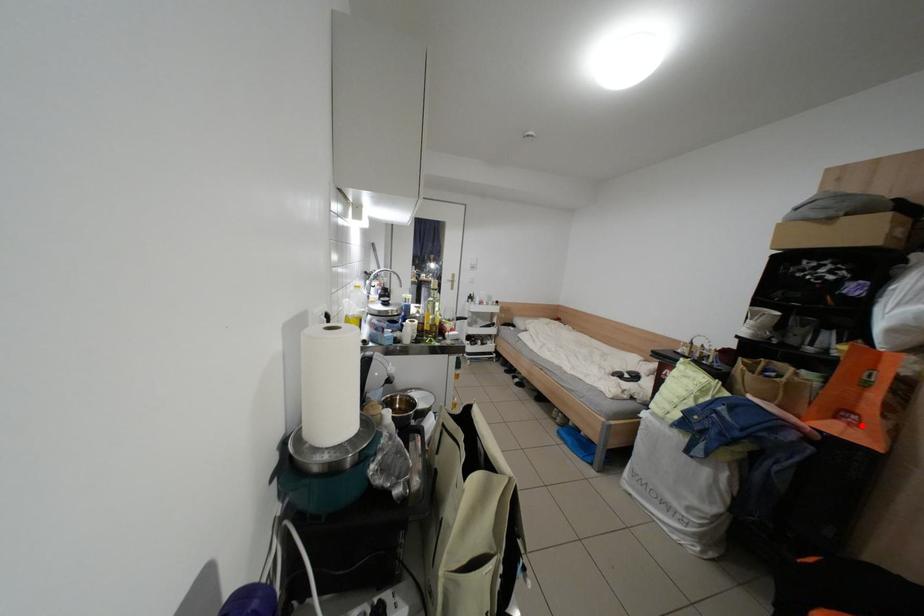
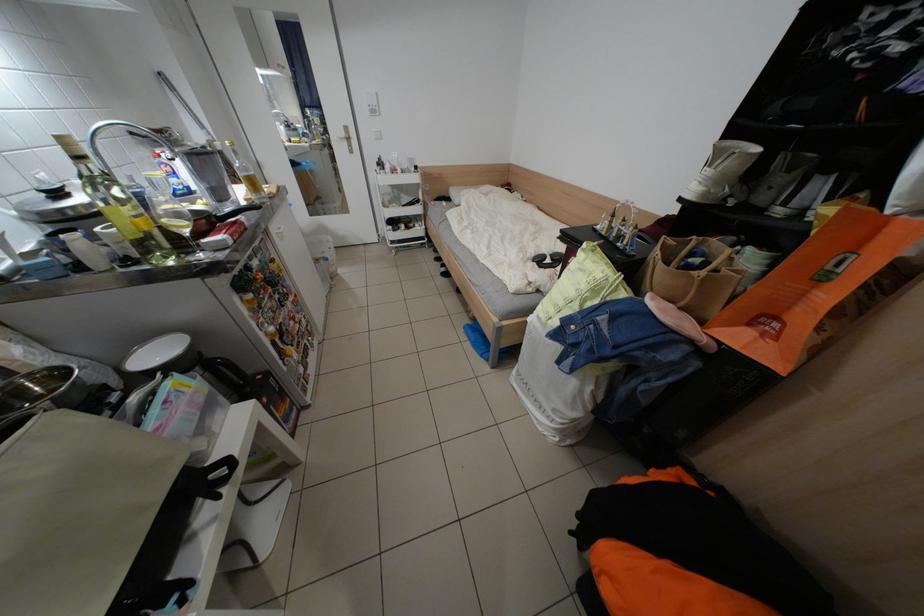
In the second image, find the point that corresponds to the highlighted location in the first image.

(775, 334)